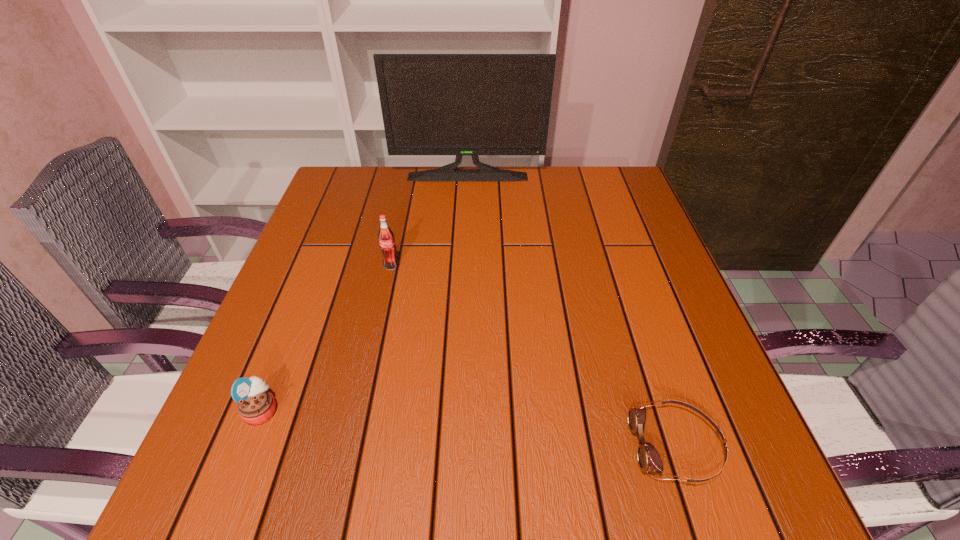
In order to click on vacant region at the near edge in this screenshot , I will do `click(400, 498)`.

In the image, there is a desktop. Identify the location of vacant space at the left edge. (340, 293).

The image size is (960, 540). What are the coordinates of `free space at the right edge` in the screenshot? It's located at (689, 377).

The image size is (960, 540). Identify the location of free space at the far left corner of the desktop. (372, 176).

At what (x,y) coordinates should I click in order to perform the action: click on vacant space at the far right corner of the desktop. Please return your answer as a coordinate pair (x, y). This screenshot has width=960, height=540. Looking at the image, I should click on (629, 202).

Find the location of a particular element. unoccupied position between the goggles and the farthest object is located at coordinates (572, 311).

You are a GUI agent. You are given a task and a screenshot of the screen. Output one action in this format:
    pyautogui.click(x=<x>, y=<y>)
    Task: Click on the vacant area between the goggles and the soda bottle
    
    Given the screenshot: What is the action you would take?
    pos(534,355)

You are a GUI agent. You are given a task and a screenshot of the screen. Output one action in this format:
    pyautogui.click(x=<x>, y=<y>)
    Task: Click on the free space between the leftmost object and the monitor
    The height and width of the screenshot is (540, 960).
    Given the screenshot: What is the action you would take?
    pyautogui.click(x=365, y=293)

This screenshot has height=540, width=960. What are the coordinates of `free area in between the monitor and the third shortest object` in the screenshot? It's located at (429, 221).

This screenshot has height=540, width=960. I want to click on free spot between the goggles and the leftmost object, so click(469, 428).